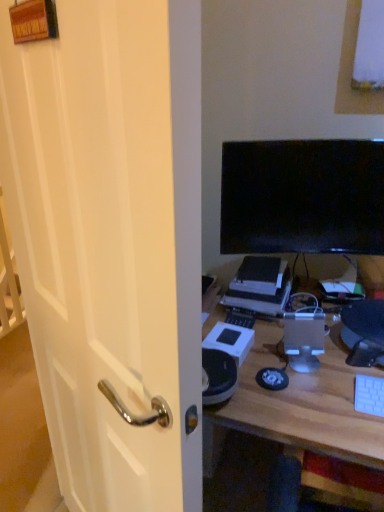
In order to click on vacant area on top of white wood desk at center (from a real-world perspective) in this screenshot , I will do `click(321, 369)`.